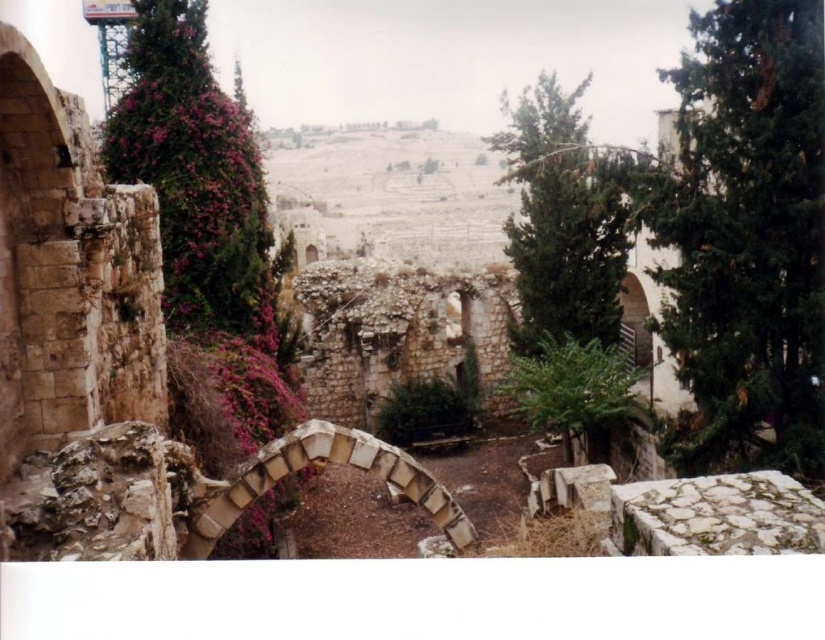
Question: Based on their relative distances, which object is farther from the green leafy tree at upper right?

Choices:
 (A) pink textured foliage at left
 (B) green textured tree at right

Answer: (A)

Question: Is green textured tree at right to the left of green leafy tree at upper right from the viewer's perspective?

Choices:
 (A) yes
 (B) no

Answer: (A)

Question: Which point appears farthest from the camera in this image?

Choices:
 (A) (559, 93)
 (B) (691, 129)

Answer: (A)

Question: Observing the image, what is the correct spatial positioning of green textured tree at right in reference to pink textured foliage at left?

Choices:
 (A) below
 (B) above

Answer: (A)

Question: Is pink textured foliage at left below green leafy tree at upper right?

Choices:
 (A) no
 (B) yes

Answer: (B)

Question: Which point is closer to the camera?

Choices:
 (A) (703, 77)
 (B) (573, 330)
 (C) (205, 253)

Answer: (A)